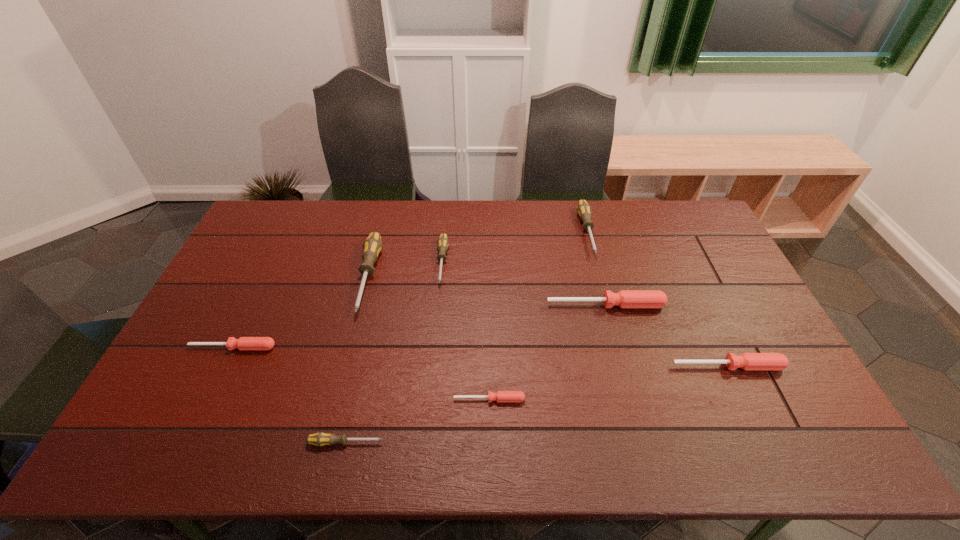
At what (x,y) coordinates should I click in order to perform the action: click on vacant space at the far right corner of the desktop. Please return your answer as a coordinate pair (x, y). Image resolution: width=960 pixels, height=540 pixels. Looking at the image, I should click on (682, 214).

The height and width of the screenshot is (540, 960). In order to click on free space between the fifth farthest object and the biggest red screwdriver in this screenshot , I will do tap(420, 326).

In order to click on empty space between the third smallest gray screwdriver and the seventh farthest screwdriver in this screenshot , I will do `click(539, 315)`.

Locate an element on the screen. blank region between the shortest object and the second smallest red screwdriver is located at coordinates (361, 373).

I want to click on free point between the fifth object from right to left and the leftmost red screwdriver, so pyautogui.click(x=338, y=305).

Locate an element on the screen. The image size is (960, 540). empty space between the farthest red screwdriver and the second biggest gray screwdriver is located at coordinates (596, 268).

I want to click on vacant space that's between the farthest red screwdriver and the third biggest gray screwdriver, so click(524, 284).

You are a GUI agent. You are given a task and a screenshot of the screen. Output one action in this format:
    pyautogui.click(x=<x>, y=<y>)
    Task: Click on the free space that is in between the nearest screwdriver and the third biggest red screwdriver
    This screenshot has width=960, height=540.
    Given the screenshot: What is the action you would take?
    pyautogui.click(x=290, y=395)

Find the location of a particular element. The image size is (960, 540). unoccupied position between the rightmost gray screwdriver and the leftmost object is located at coordinates (410, 289).

Locate an element on the screen. The image size is (960, 540). empty location between the leftmost red screwdriver and the tallest object is located at coordinates (300, 312).